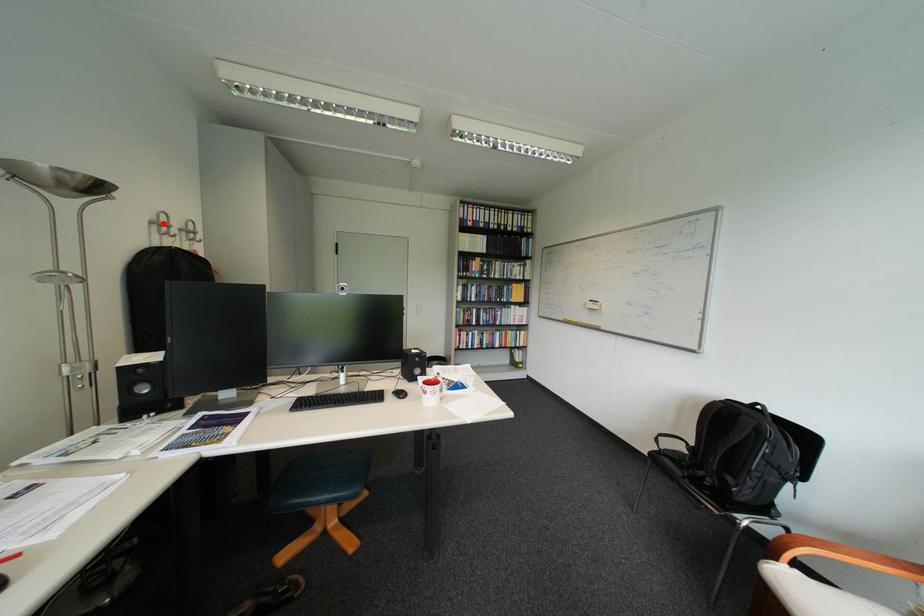
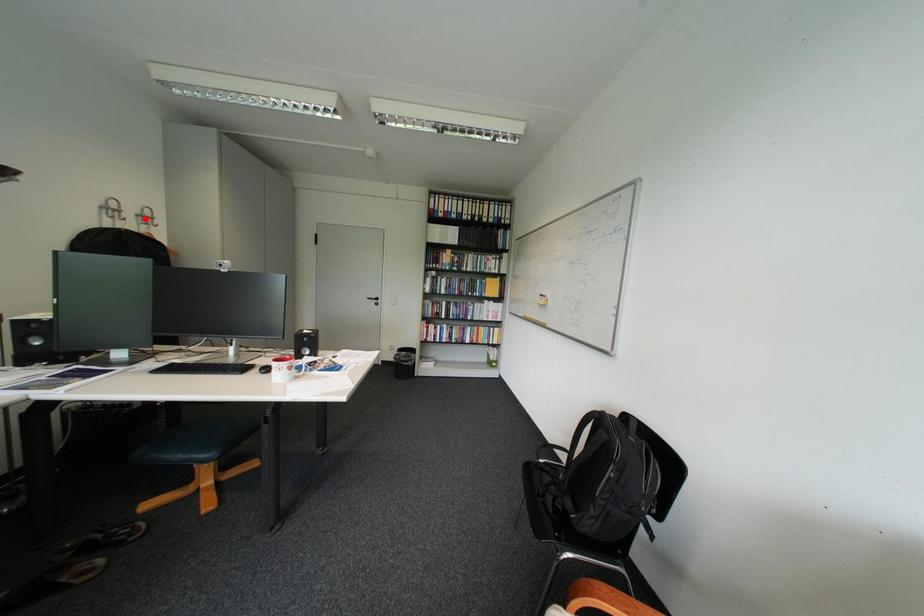
I am providing you with two images of the same scene from different viewpoints. A red point is marked on the first image and another point is marked on the second image. Does the point marked in image1 correspond to the same location as the one in image2?

No